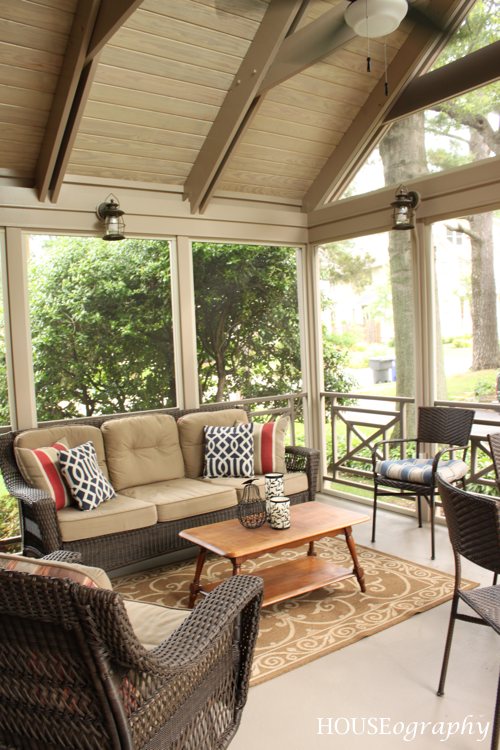
Find the location of a particular element. The image size is (500, 750). chair is located at coordinates (467, 532), (443, 424), (495, 450), (66, 673).